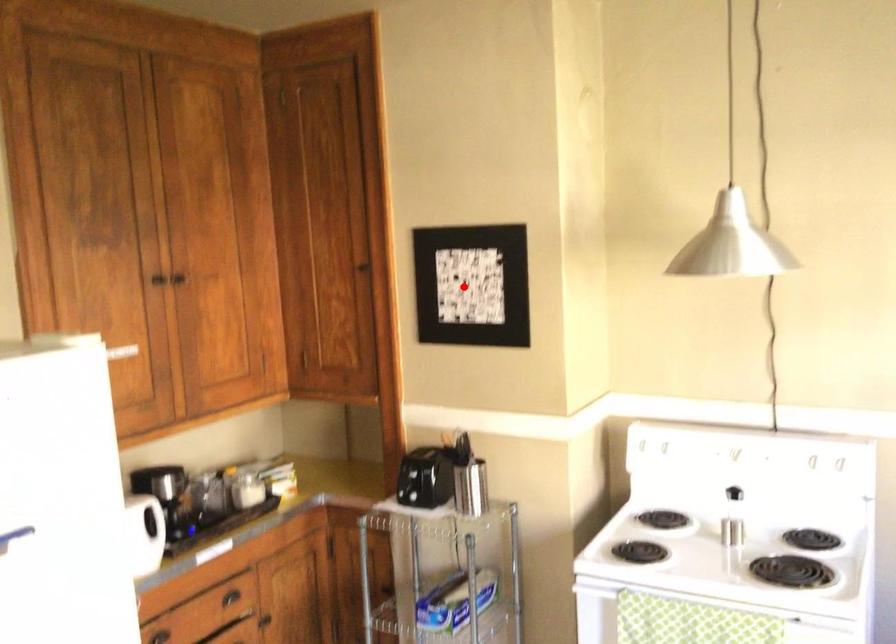
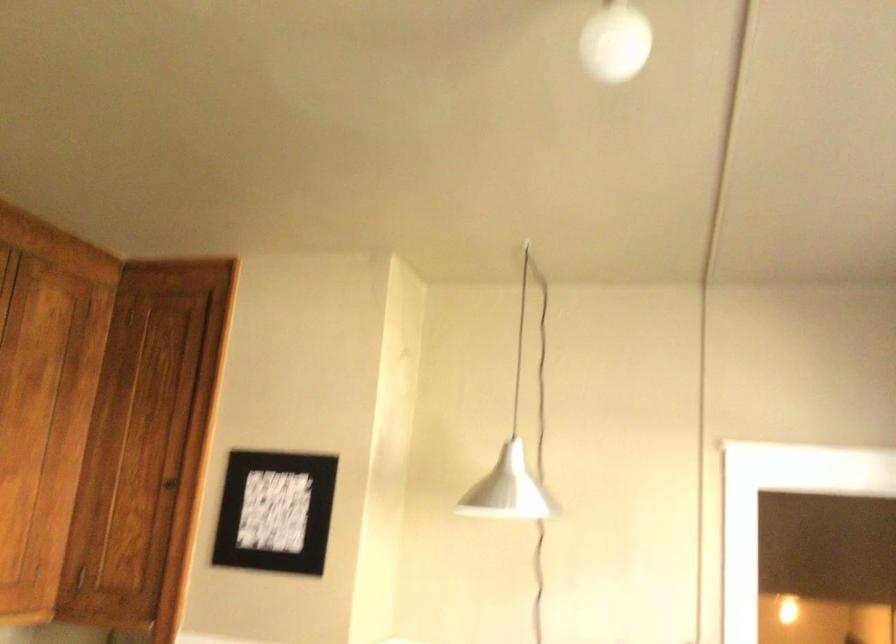
Where in the second image is the point corresponding to the highlighted location from the first image?

(274, 512)